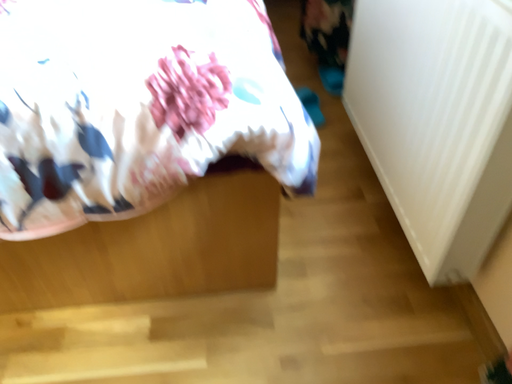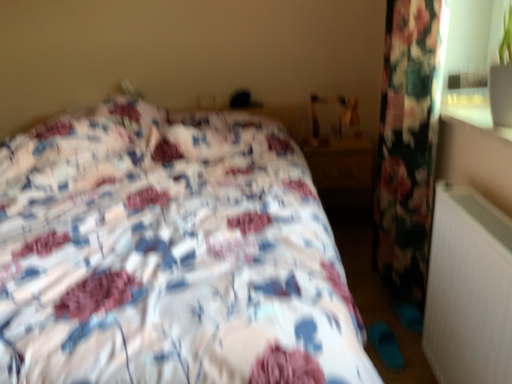
Question: Which way did the camera rotate in the video?

Choices:
 (A) rotated left
 (B) rotated right

Answer: (A)